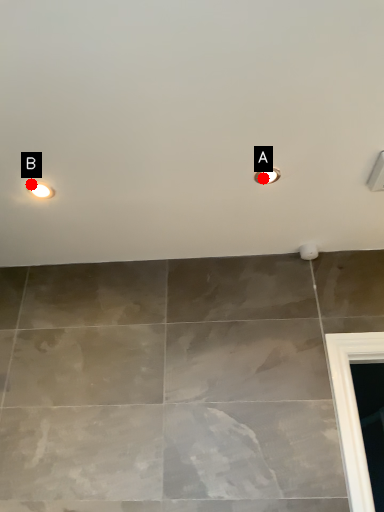
Question: Two points are circled on the image, labeled by A and B beside each circle. Which of the following is the closest to the observer?

Choices:
 (A) A is closer
 (B) B is closer

Answer: (A)